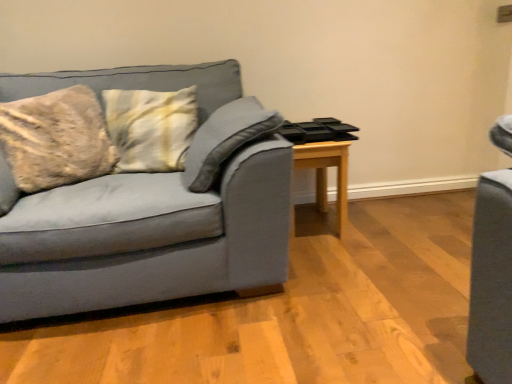
Question: Does point (326, 188) appear closer or farther from the camera than point (287, 205)?

Choices:
 (A) farther
 (B) closer

Answer: (A)

Question: Is light wood table at center bigger or smaller than matte gray couch at left?

Choices:
 (A) small
 (B) big

Answer: (A)

Question: Considering the positions of light wood table at center and matte gray couch at left in the image, is light wood table at center taller or shorter than matte gray couch at left?

Choices:
 (A) short
 (B) tall

Answer: (A)

Question: Is matte gray couch at left wider or thinner than light wood table at center?

Choices:
 (A) thin
 (B) wide

Answer: (B)

Question: Is matte gray couch at left to the left or to the right of light wood table at center in the image?

Choices:
 (A) right
 (B) left

Answer: (B)

Question: From a real-world perspective, relative to light wood table at center, is matte gray couch at left vertically above or below?

Choices:
 (A) above
 (B) below

Answer: (A)

Question: Does point (88, 230) appear closer or farther from the camera than point (316, 180)?

Choices:
 (A) closer
 (B) farther

Answer: (A)